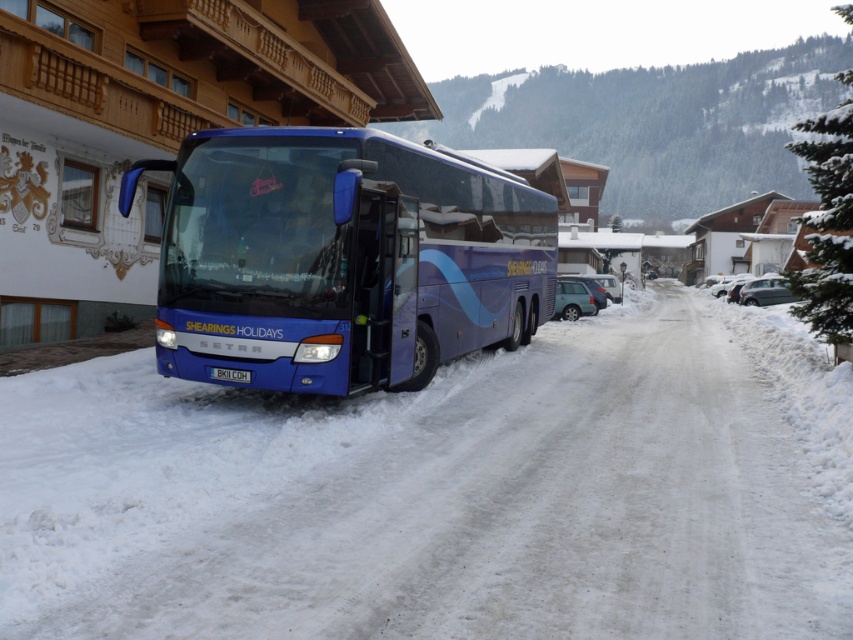
Based on the photo, which of these two, white powdery snow at center or blue metallic bus at center, stands shorter?

white powdery snow at center is shorter.

Is white powdery snow at center to the right of blue metallic bus at center from the viewer's perspective?

Indeed, white powdery snow at center is positioned on the right side of blue metallic bus at center.

Image resolution: width=853 pixels, height=640 pixels. In order to click on white powdery snow at center in this screenshot , I will do `click(444, 492)`.

At what (x,y) coordinates should I click in order to perform the action: click on white powdery snow at center. Please return your answer as a coordinate pair (x, y). This screenshot has height=640, width=853. Looking at the image, I should click on (444, 492).